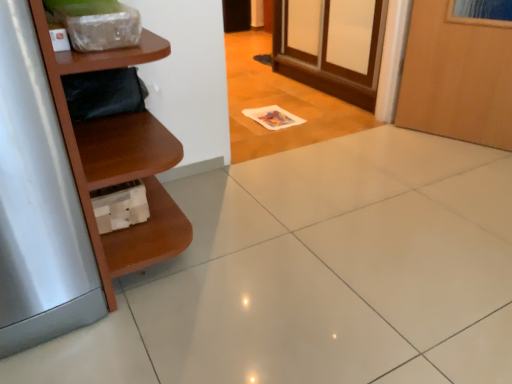
I want to click on spots to the right of brown wood shelf at left, so click(x=269, y=236).